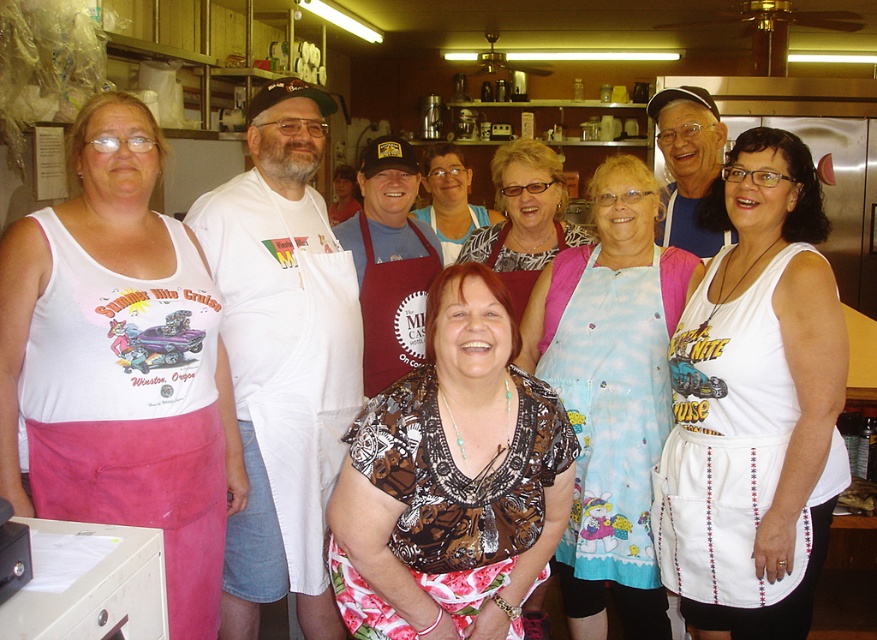
You are a photographer trying to capture a group photo of the team in the kitchen. You notice the brown printed blouse at center and the matte brown apron at center. To ensure both are clearly visible in the photo, which one should you focus on more closely?

The brown printed blouse at center might be wider than matte brown apron at center, so you should focus on the brown printed blouse at center to ensure it is clearly visible.